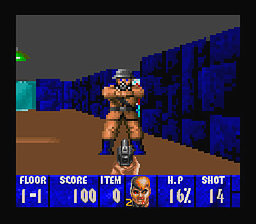
Find the location of `floor`. floor is located at coordinates (38, 193).